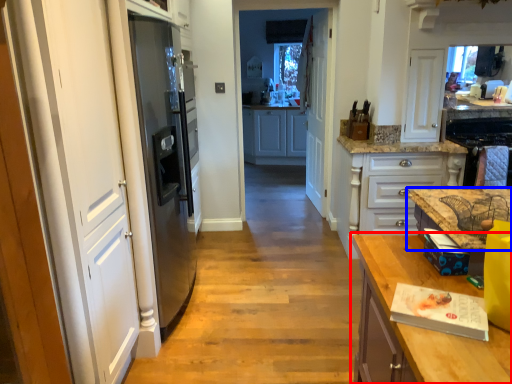
Question: Which of the following is the closest to the observer, countertop (highlighted by a red box) or countertop (highlighted by a blue box)?

Choices:
 (A) countertop
 (B) countertop

Answer: (A)